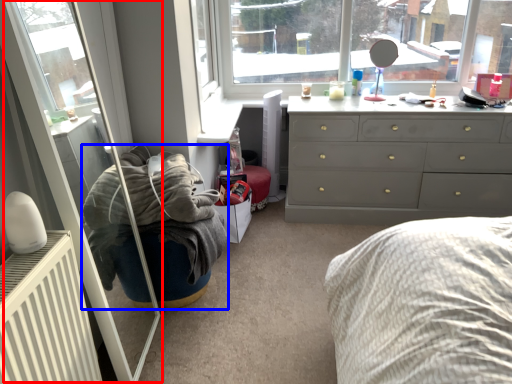
Question: Which object is further to the camera taking this photo, screen door (highlighted by a red box) or bean bag chair (highlighted by a blue box)?

Choices:
 (A) screen door
 (B) bean bag chair

Answer: (B)